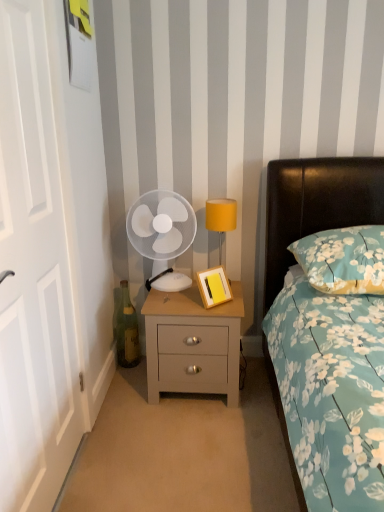
Question: Is floral fabric pillow at right at the left side of white wooden door at left?

Choices:
 (A) no
 (B) yes

Answer: (A)

Question: Considering the relative sizes of floral fabric pillow at right and white wooden door at left in the image provided, is floral fabric pillow at right thinner than white wooden door at left?

Choices:
 (A) no
 (B) yes

Answer: (A)

Question: Is floral fabric pillow at right not inside white wooden door at left?

Choices:
 (A) yes
 (B) no

Answer: (A)

Question: Is floral fabric pillow at right smaller than white wooden door at left?

Choices:
 (A) yes
 (B) no

Answer: (A)

Question: Does floral fabric pillow at right have a larger size compared to white wooden door at left?

Choices:
 (A) no
 (B) yes

Answer: (A)

Question: From the image's perspective, would you say floral fabric pillow at right is positioned over white wooden door at left?

Choices:
 (A) yes
 (B) no

Answer: (A)

Question: Does yellow fabric lampshade at upper right have a lesser width compared to wooden picture frame at bedside table?

Choices:
 (A) yes
 (B) no

Answer: (B)

Question: Is yellow fabric lampshade at upper right touching wooden picture frame at bedside table?

Choices:
 (A) yes
 (B) no

Answer: (B)

Question: Is yellow fabric lampshade at upper right looking in the opposite direction of wooden picture frame at bedside table?

Choices:
 (A) yes
 (B) no

Answer: (B)

Question: Is yellow fabric lampshade at upper right not close to wooden picture frame at bedside table?

Choices:
 (A) yes
 (B) no

Answer: (B)

Question: Is yellow fabric lampshade at upper right to the right of wooden picture frame at bedside table from the viewer's perspective?

Choices:
 (A) no
 (B) yes

Answer: (B)

Question: Can you confirm if yellow fabric lampshade at upper right is wider than wooden picture frame at bedside table?

Choices:
 (A) no
 (B) yes

Answer: (B)

Question: From a real-world perspective, is wooden picture frame at bedside table below floral fabric pillow at right?

Choices:
 (A) no
 (B) yes

Answer: (B)